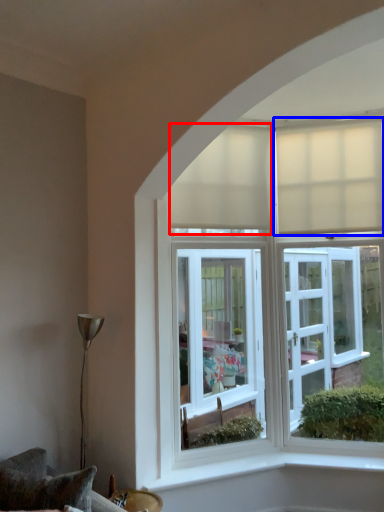
Question: Which of the following is the farthest to the observer, curtain (highlighted by a red box) or curtain (highlighted by a blue box)?

Choices:
 (A) curtain
 (B) curtain

Answer: (B)